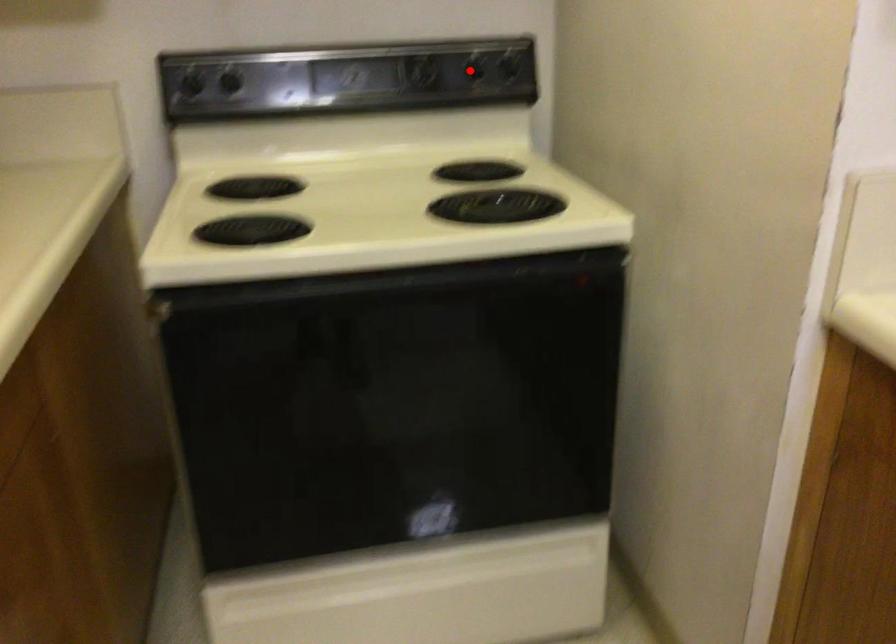
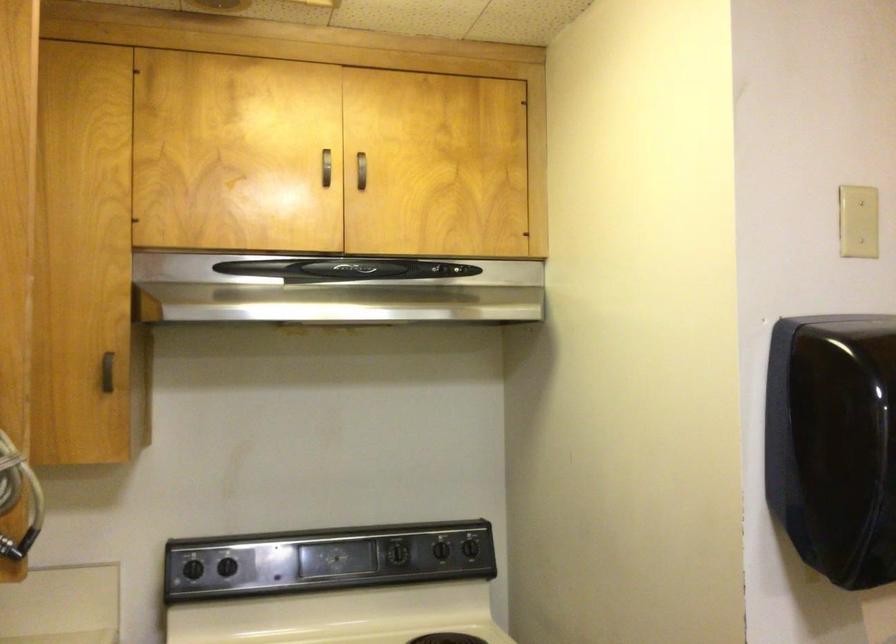
Locate, in the second image, the point that corresponds to the highlighted location in the first image.

(440, 549)